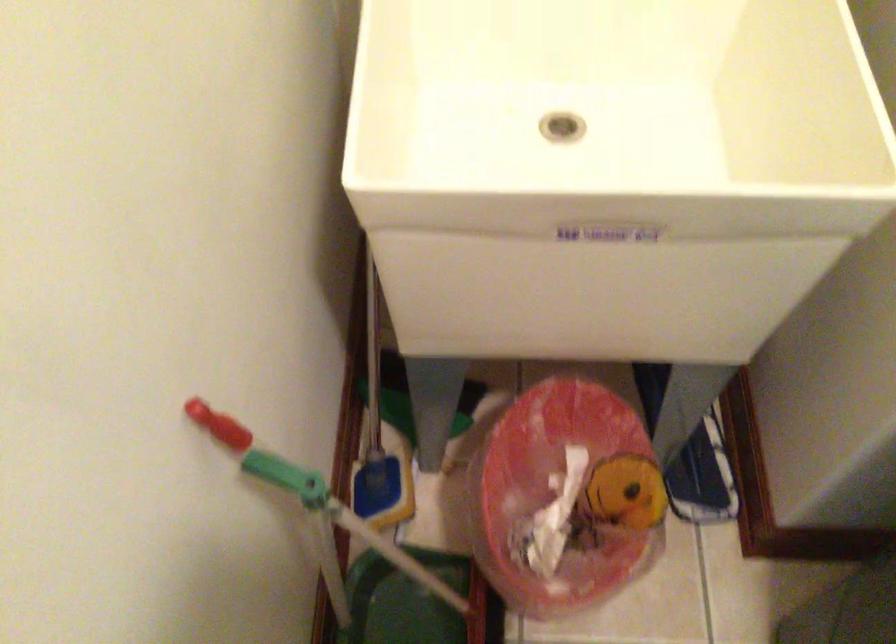
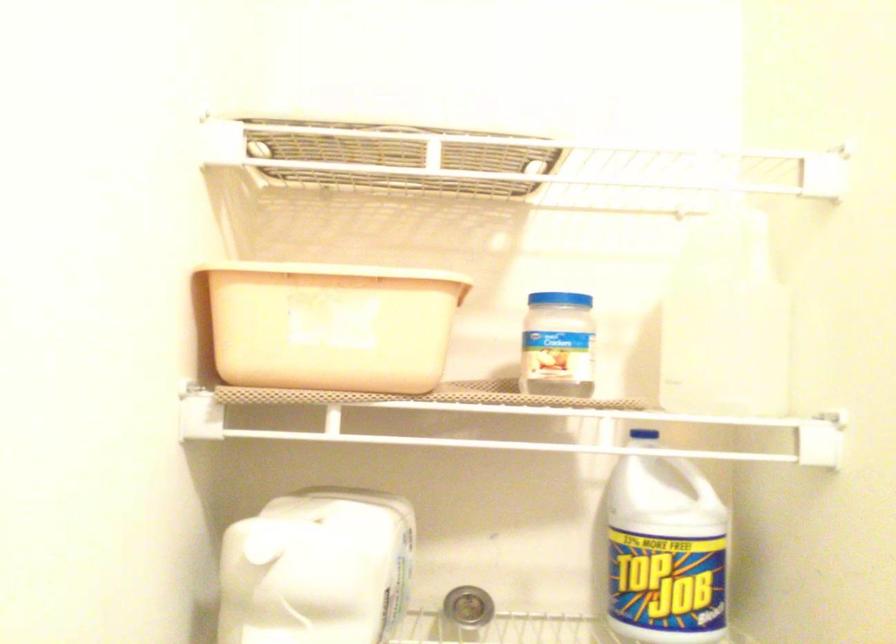
Question: The images are taken continuously from a first-person perspective. In which direction is your viewpoint rotating?

Choices:
 (A) Left
 (B) Right
 (C) Up
 (D) Down

Answer: (C)